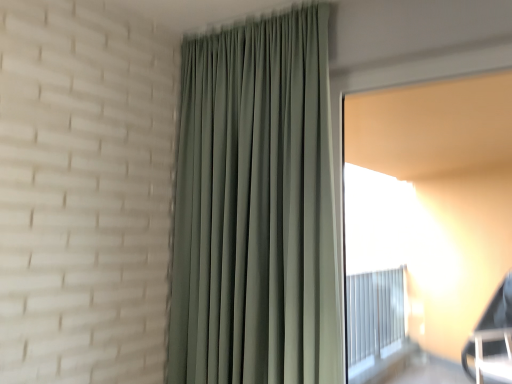
Question: From the image's perspective, is white matte window screen at right under sage green fabric curtain at center?

Choices:
 (A) no
 (B) yes

Answer: (B)

Question: Is white matte window screen at right oriented away from sage green fabric curtain at center?

Choices:
 (A) no
 (B) yes

Answer: (A)

Question: Can you confirm if white matte window screen at right is smaller than sage green fabric curtain at center?

Choices:
 (A) no
 (B) yes

Answer: (B)

Question: Does white matte window screen at right have a greater width compared to sage green fabric curtain at center?

Choices:
 (A) no
 (B) yes

Answer: (A)

Question: From a real-world perspective, does white matte window screen at right stand above sage green fabric curtain at center?

Choices:
 (A) no
 (B) yes

Answer: (A)

Question: Is white matte window screen at right not inside sage green fabric curtain at center?

Choices:
 (A) no
 (B) yes

Answer: (B)

Question: Is the depth of sage green fabric curtain at center greater than that of white matte window screen at right?

Choices:
 (A) yes
 (B) no

Answer: (A)

Question: Considering the relative positions of sage green fabric curtain at center and white matte window screen at right in the image provided, is sage green fabric curtain at center to the left of white matte window screen at right from the viewer's perspective?

Choices:
 (A) yes
 (B) no

Answer: (A)

Question: Is sage green fabric curtain at center wider than white matte window screen at right?

Choices:
 (A) no
 (B) yes

Answer: (B)

Question: From the image's perspective, is sage green fabric curtain at center under white matte window screen at right?

Choices:
 (A) yes
 (B) no

Answer: (B)

Question: Could you tell me if sage green fabric curtain at center is facing white matte window screen at right?

Choices:
 (A) no
 (B) yes

Answer: (A)

Question: From the image's perspective, is sage green fabric curtain at center on top of white matte window screen at right?

Choices:
 (A) no
 (B) yes

Answer: (B)

Question: Is white matte window screen at right wider or thinner than sage green fabric curtain at center?

Choices:
 (A) wide
 (B) thin

Answer: (B)